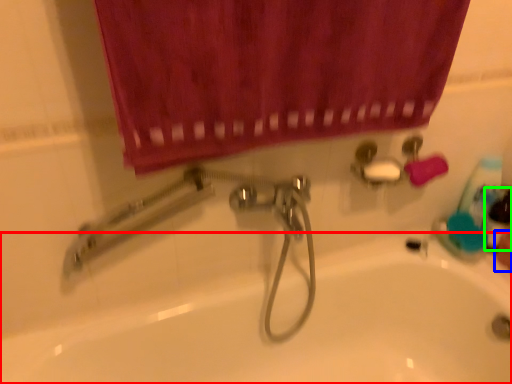
Question: Which object is the closest to the bath (highlighted by a red box)? Choose among these: hand (highlighted by a blue box) or mouthwash (highlighted by a green box).

Choices:
 (A) hand
 (B) mouthwash

Answer: (B)